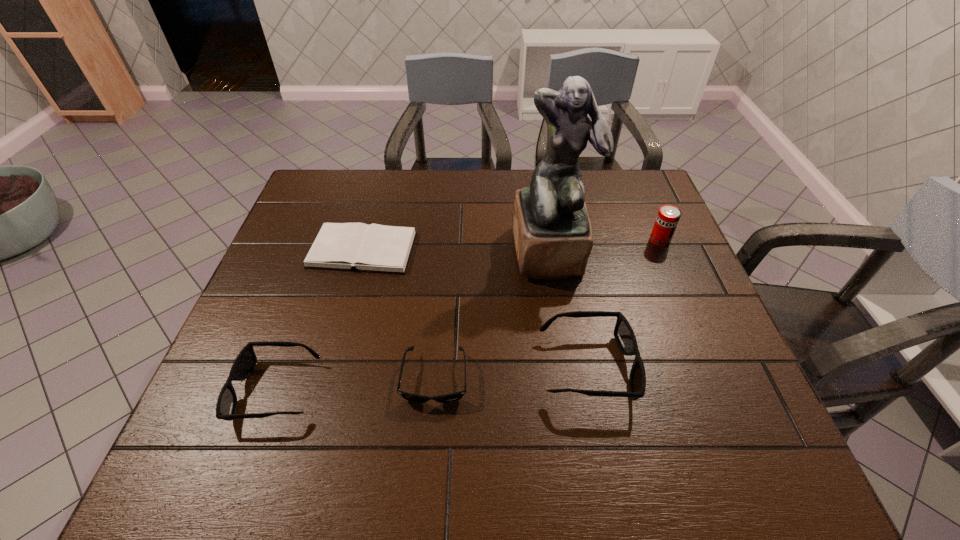
Please point a spot on the right to add another sunglasses. Please provide its 2D coordinates. Your answer should be formatted as a tuple, i.e. [(x, y)], where the tuple contains the x and y coordinates of a point satisfying the conditions above.

[(734, 356)]